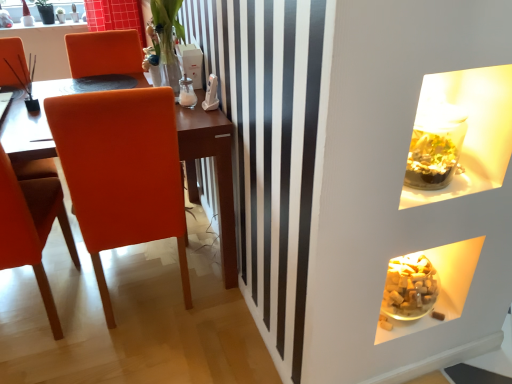
Locate an element on the screen. The height and width of the screenshot is (384, 512). matte orange chair at left, which is the second chair in right-to-left order is located at coordinates (32, 228).

Describe the element at coordinates (438, 315) in the screenshot. I see `brown sugar cubes at lower right, the second food in the left-to-right sequence` at that location.

Measure the distance between orange leather chair at left, arranged as the 1th chair when viewed from the right, and camera.

orange leather chair at left, arranged as the 1th chair when viewed from the right, and camera are 3.88 feet apart.

Find the location of a particular element. The height and width of the screenshot is (384, 512). translucent glass vase at upper center is located at coordinates (163, 64).

Are orange leather chair at left, arranged as the 1th chair when viewed from the right, and matte orange chair at left, which is the first chair from left to right, far apart?

orange leather chair at left, arranged as the 1th chair when viewed from the right, is actually quite close to matte orange chair at left, which is the first chair from left to right.

From the picture: From a real-world perspective, is orange leather chair at left, arranged as the 1th chair when viewed from the right, positioned above or below matte orange chair at left, which is the second chair in right-to-left order?

In terms of real-world spatial position, orange leather chair at left, arranged as the 1th chair when viewed from the right, is above matte orange chair at left, which is the second chair in right-to-left order.

Considering the points (82, 145) and (69, 236), which point is in front, point (82, 145) or point (69, 236)?

The point (82, 145) is in front.

Find the location of a particular element. The image size is (512, 384). the 2nd chair above the brown sugar cubes at lower right, the second food in the left-to-right sequence (from a real-world perspective) is located at coordinates (121, 172).

Consider the image. What's the angular difference between brown sugar cubes at lower right, the 1th food viewed from the right, and orange leather chair at left, arranged as the 1th chair when viewed from the right,'s facing directions?

The angle between the facing direction of brown sugar cubes at lower right, the 1th food viewed from the right, and the facing direction of orange leather chair at left, arranged as the 1th chair when viewed from the right, is 179 degrees.

Considering the positions of objects brown sugar cubes at lower right, the second food in the left-to-right sequence, and orange leather chair at left, arranged as the 1th chair when viewed from the right, in the image provided, who is behind, brown sugar cubes at lower right, the second food in the left-to-right sequence, or orange leather chair at left, arranged as the 1th chair when viewed from the right,?

Positioned behind is brown sugar cubes at lower right, the second food in the left-to-right sequence.

Can you see brown sugar cubes at lower right, the second food in the left-to-right sequence, touching orange leather chair at left, arranged as the 1th chair when viewed from the right?

brown sugar cubes at lower right, the second food in the left-to-right sequence, is not next to orange leather chair at left, arranged as the 1th chair when viewed from the right, and they're not touching.

Considering the relative positions of translucent glass vase at upper center and orange leather chair at left, arranged as the 1th chair when viewed from the right, in the image provided, is translucent glass vase at upper center behind orange leather chair at left, arranged as the 1th chair when viewed from the right,?

Yes, it is behind orange leather chair at left, arranged as the 1th chair when viewed from the right.

From a real-world perspective, is translucent glass vase at upper center located beneath orange leather chair at left, which is counted as the second chair, starting from the left?

No, from a real-world perspective, translucent glass vase at upper center is not beneath orange leather chair at left, which is counted as the second chair, starting from the left.

Which of these two, translucent glass vase at upper center or orange leather chair at left, arranged as the 1th chair when viewed from the right, stands shorter?

With less height is translucent glass vase at upper center.

From the picture: How much distance is there between translucent glass vase at upper center and orange leather chair at left, which is counted as the second chair, starting from the left?

translucent glass vase at upper center and orange leather chair at left, which is counted as the second chair, starting from the left, are 22.54 inches apart from each other.

Are translucent glass cubes at lower right, which appears as the 2th food when viewed from the right, and brown sugar cubes at lower right, the second food in the left-to-right sequence, located far from each other?

Actually, translucent glass cubes at lower right, which appears as the 2th food when viewed from the right, and brown sugar cubes at lower right, the second food in the left-to-right sequence, are a little close together.

Is translucent glass cubes at lower right, which is the 1th food from left to right, facing towards brown sugar cubes at lower right, the second food in the left-to-right sequence?

No, translucent glass cubes at lower right, which is the 1th food from left to right, is not aimed at brown sugar cubes at lower right, the second food in the left-to-right sequence.

Is translucent glass cubes at lower right, which appears as the 2th food when viewed from the right, bigger than brown sugar cubes at lower right, the second food in the left-to-right sequence?

Indeed, translucent glass cubes at lower right, which appears as the 2th food when viewed from the right, has a larger size compared to brown sugar cubes at lower right, the second food in the left-to-right sequence.

Based on the photo, in the image, is translucent glass cubes at lower right, which is the 1th food from left to right, positioned in front of or behind brown sugar cubes at lower right, the second food in the left-to-right sequence?

Clearly, translucent glass cubes at lower right, which is the 1th food from left to right, is in front of brown sugar cubes at lower right, the second food in the left-to-right sequence.

Can you confirm if translucent glass cubes at lower right, which appears as the 2th food when viewed from the right, is bigger than translucent glass vase at upper center?

Actually, translucent glass cubes at lower right, which appears as the 2th food when viewed from the right, might be smaller than translucent glass vase at upper center.

How much distance is there between translucent glass cubes at lower right, which is the 1th food from left to right, and translucent glass vase at upper center?

The distance of translucent glass cubes at lower right, which is the 1th food from left to right, from translucent glass vase at upper center is 1.29 meters.

In the scene shown: Does translucent glass cubes at lower right, which is the 1th food from left to right, come in front of translucent glass vase at upper center?

Yes, it is in front of translucent glass vase at upper center.

Looking at this image, considering the sizes of translucent glass cubes at lower right, which appears as the 2th food when viewed from the right, and translucent glass vase at upper center in the image, is translucent glass cubes at lower right, which appears as the 2th food when viewed from the right, wider or thinner than translucent glass vase at upper center?

In the image, translucent glass cubes at lower right, which appears as the 2th food when viewed from the right, appears to be more narrow than translucent glass vase at upper center.

Considering the sizes of objects orange leather chair at left, which is counted as the second chair, starting from the left, and brown sugar cubes at lower right, the second food in the left-to-right sequence, in the image provided, who is bigger, orange leather chair at left, which is counted as the second chair, starting from the left, or brown sugar cubes at lower right, the second food in the left-to-right sequence,?

orange leather chair at left, which is counted as the second chair, starting from the left.

From the image's perspective, is orange leather chair at left, which is counted as the second chair, starting from the left, located above or below brown sugar cubes at lower right, the 1th food viewed from the right?

From the image's perspective, orange leather chair at left, which is counted as the second chair, starting from the left, appears above brown sugar cubes at lower right, the 1th food viewed from the right.

Based on the photo, can brown sugar cubes at lower right, the 1th food viewed from the right, be found inside orange leather chair at left, arranged as the 1th chair when viewed from the right?

No, brown sugar cubes at lower right, the 1th food viewed from the right, is not inside orange leather chair at left, arranged as the 1th chair when viewed from the right.

In the scene shown: From the image's perspective, is matte orange chair at left, which is the first chair from left to right, on orange leather chair at left, arranged as the 1th chair when viewed from the right?

No, from the image's perspective, matte orange chair at left, which is the first chair from left to right, is not above orange leather chair at left, arranged as the 1th chair when viewed from the right.

Which is nearer, [44,192] or [95,258]?

Point [44,192] is closer to the camera than point [95,258].

From the picture: Which of these two, matte orange chair at left, which is the first chair from left to right, or orange leather chair at left, which is counted as the second chair, starting from the left, stands shorter?

matte orange chair at left, which is the first chair from left to right.

From a real-world perspective, relative to orange leather chair at left, arranged as the 1th chair when viewed from the right, is matte orange chair at left, which is the second chair in right-to-left order, vertically above or below?

Clearly, from a real-world perspective, matte orange chair at left, which is the second chair in right-to-left order, is below orange leather chair at left, arranged as the 1th chair when viewed from the right.

This screenshot has width=512, height=384. I want to click on chair behind the matte orange chair at left, which is the first chair from left to right, so click(121, 172).

Identify the location of chair that is the 2nd object located above the brown sugar cubes at lower right, the 1th food viewed from the right (from the image's perspective). (121, 172).

Looking at the image, which one is located closer to brown sugar cubes at lower right, the second food in the left-to-right sequence, translucent glass cubes at lower right, which appears as the 2th food when viewed from the right, or orange leather chair at left, arranged as the 1th chair when viewed from the right?

translucent glass cubes at lower right, which appears as the 2th food when viewed from the right, is closer to brown sugar cubes at lower right, the second food in the left-to-right sequence.

Based on their spatial positions, is matte orange chair at left, which is the first chair from left to right, or translucent glass vase at upper center further from orange leather chair at left, which is counted as the second chair, starting from the left?

translucent glass vase at upper center lies further to orange leather chair at left, which is counted as the second chair, starting from the left, than the other object.

From the image, which object appears to be nearer to translucent glass cubes at lower right, which is the 1th food from left to right, brown sugar cubes at lower right, the 1th food viewed from the right, or orange leather chair at left, arranged as the 1th chair when viewed from the right?

The object closer to translucent glass cubes at lower right, which is the 1th food from left to right, is brown sugar cubes at lower right, the 1th food viewed from the right.

When comparing their distances from translucent glass cubes at lower right, which appears as the 2th food when viewed from the right, does brown sugar cubes at lower right, the second food in the left-to-right sequence, or matte orange chair at left, which is the second chair in right-to-left order, seem closer?

brown sugar cubes at lower right, the second food in the left-to-right sequence, lies closer to translucent glass cubes at lower right, which appears as the 2th food when viewed from the right, than the other object.

Looking at the image, which one is located further to brown sugar cubes at lower right, the 1th food viewed from the right, translucent glass vase at upper center or translucent glass cubes at lower right, which is the 1th food from left to right?

translucent glass vase at upper center lies further to brown sugar cubes at lower right, the 1th food viewed from the right, than the other object.

When comparing their distances from brown sugar cubes at lower right, the second food in the left-to-right sequence, does translucent glass vase at upper center or orange leather chair at left, arranged as the 1th chair when viewed from the right, seem closer?

orange leather chair at left, arranged as the 1th chair when viewed from the right, lies closer to brown sugar cubes at lower right, the second food in the left-to-right sequence, than the other object.

Considering their positions, is matte orange chair at left, which is the second chair in right-to-left order, positioned closer to brown sugar cubes at lower right, the second food in the left-to-right sequence, than orange leather chair at left, arranged as the 1th chair when viewed from the right?

orange leather chair at left, arranged as the 1th chair when viewed from the right.

Which object lies further to the anchor point brown sugar cubes at lower right, the 1th food viewed from the right, translucent glass vase at upper center or matte orange chair at left, which is the second chair in right-to-left order?

Based on the image, matte orange chair at left, which is the second chair in right-to-left order, appears to be further to brown sugar cubes at lower right, the 1th food viewed from the right.

Where is `food situated between orange leather chair at left, which is counted as the second chair, starting from the left, and brown sugar cubes at lower right, the 1th food viewed from the right, from left to right`? food situated between orange leather chair at left, which is counted as the second chair, starting from the left, and brown sugar cubes at lower right, the 1th food viewed from the right, from left to right is located at coordinates (384, 322).

The height and width of the screenshot is (384, 512). Find the location of `glass vase between orange leather chair at left, which is counted as the second chair, starting from the left, and translucent glass cubes at lower right, which is the 1th food from left to right`. glass vase between orange leather chair at left, which is counted as the second chair, starting from the left, and translucent glass cubes at lower right, which is the 1th food from left to right is located at coordinates (163, 64).

The width and height of the screenshot is (512, 384). Identify the location of glass vase located between matte orange chair at left, which is the second chair in right-to-left order, and brown sugar cubes at lower right, the second food in the left-to-right sequence, in the left-right direction. (163, 64).

Where is `chair between translucent glass vase at upper center and matte orange chair at left, which is the second chair in right-to-left order, in the vertical direction`? chair between translucent glass vase at upper center and matte orange chair at left, which is the second chair in right-to-left order, in the vertical direction is located at coordinates (121, 172).